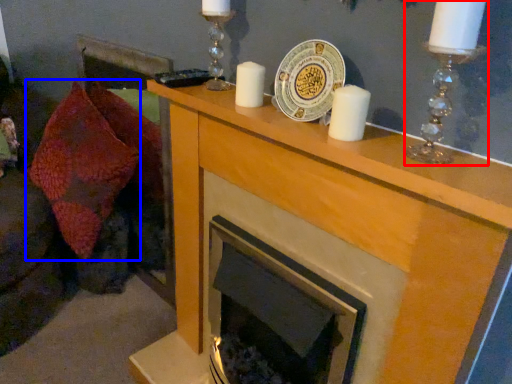
Question: Among these objects, which one is farthest to the camera, candle holder (highlighted by a red box) or throw pillow (highlighted by a blue box)?

Choices:
 (A) candle holder
 (B) throw pillow

Answer: (B)